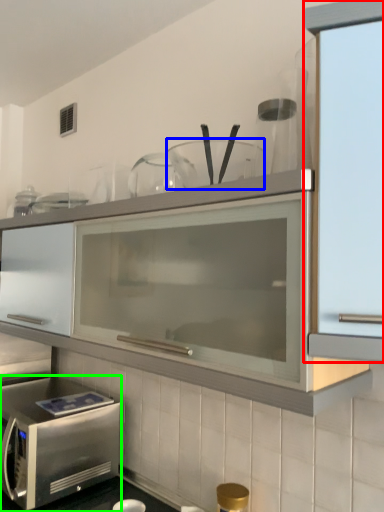
Question: Estimate the real-world distances between objects in this image. Which object is closer to cabinetry (highlighted by a red box), tableware (highlighted by a blue box) or microwave oven (highlighted by a green box)?

Choices:
 (A) tableware
 (B) microwave oven

Answer: (A)